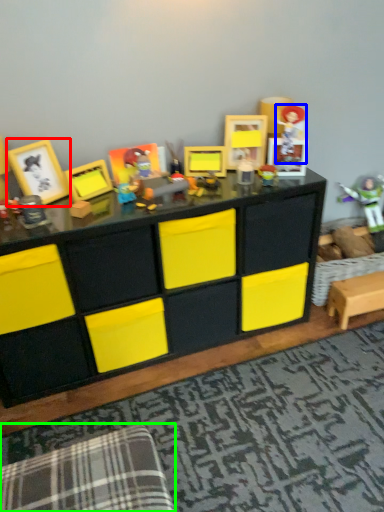
Question: Which is farther away from picture frame (highlighted by a red box)? toy (highlighted by a blue box) or swivel chair (highlighted by a green box)?

Choices:
 (A) toy
 (B) swivel chair

Answer: (B)